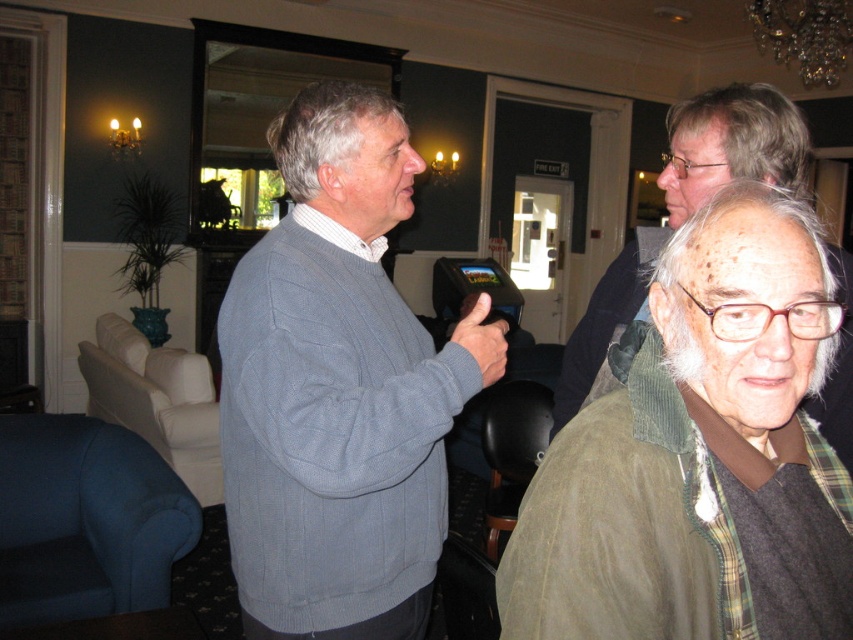
Question: Which of the following is the farthest from the observer?

Choices:
 (A) (57, 544)
 (B) (175, 438)

Answer: (B)

Question: Considering the real-world distances, which object is closest to the green corduroy jacket at center?

Choices:
 (A) green corduroy jacket at upper right
 (B) blue fabric armchair at lower left
 (C) beige fabric armchair at left
 (D) knitted gray sweater at center

Answer: (A)

Question: Is knitted gray sweater at center wider than blue fabric armchair at lower left?

Choices:
 (A) yes
 (B) no

Answer: (B)

Question: Which point is closer to the camera?

Choices:
 (A) green corduroy jacket at center
 (B) dark brown leather armchair at lower center

Answer: (A)

Question: Does knitted gray sweater at center have a larger size compared to green corduroy jacket at upper right?

Choices:
 (A) yes
 (B) no

Answer: (B)

Question: Does knitted sweater at center appear over dark brown leather armchair at lower center?

Choices:
 (A) yes
 (B) no

Answer: (A)